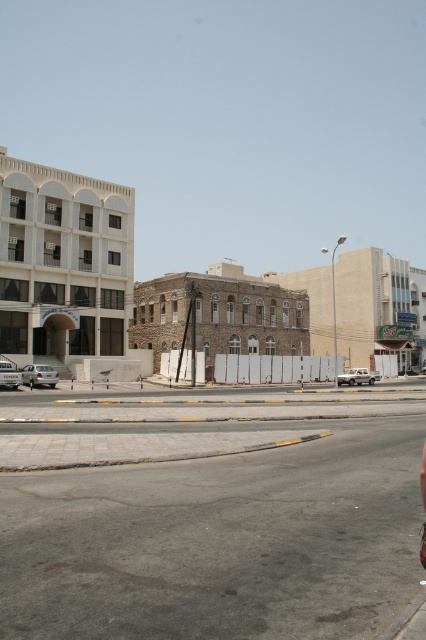
From the picture: You are a delivery driver approaching the buildings in the scene. Which building, the white matte building at upper left or the beige stone building at center, would you reach first?

You would reach the white matte building at upper left first because it is closer to the viewer than the beige stone building at center.

Consider the image. You are a delivery driver approaching the intersection and need to determine the safest path. Based on the scene, which building, the white matte building at upper left or the brown stone building at center, is closer to you as you drive along the road?

The white matte building at upper left is closer to you because it is positioned in front of the brown stone building at center, meaning it is nearer to your viewpoint along the road.

You are standing on the sidewalk on the left side of the road and want to reach the point marked as point (2,285). Given that the road is 12 feet wide, can you safely cross the road to reach that point without stepping into the traffic lane?

The point marked as point (2,285) is 158.63 feet away from the viewer. Since the road is only 12 feet wide, you can safely cross the road to reach that point without entering the traffic lane.